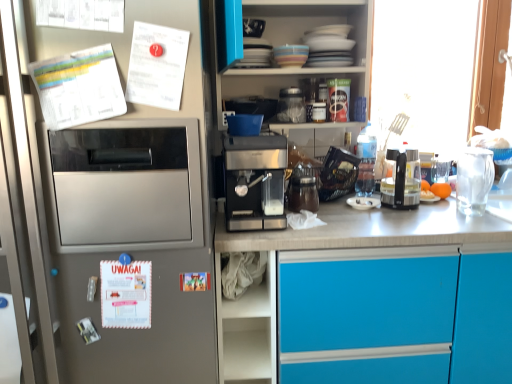
What are the coordinates of `free location to the right of sleek metallic espresso machine at center` in the screenshot? It's located at (343, 223).